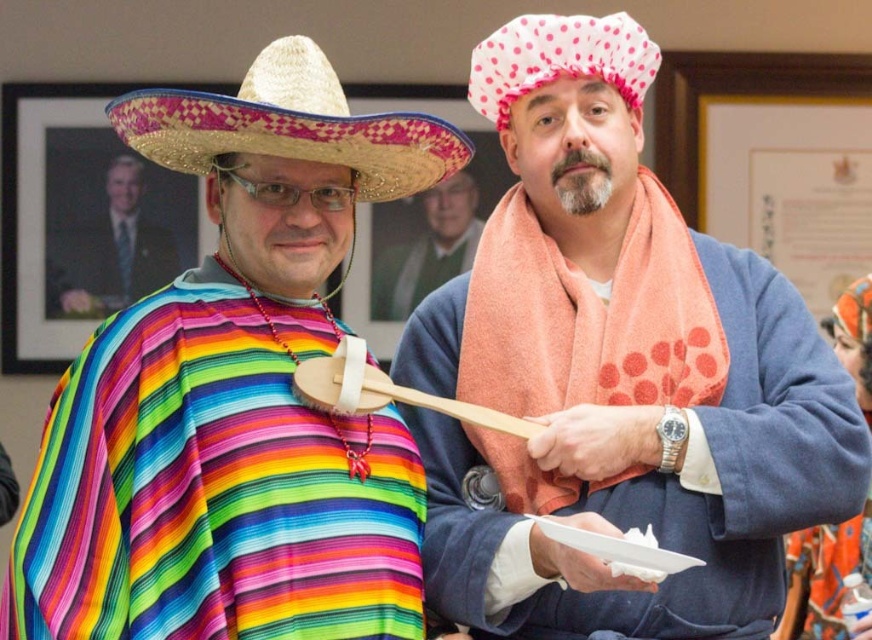
Question: Which of the following is the farthest from the observer?

Choices:
 (A) (584, 72)
 (B) (469, 568)
 (C) (402, 164)
 (D) (58, 259)

Answer: (D)

Question: Is pink polka dot fabric at upper center positioned at the back of wooden smooth spoon at center?

Choices:
 (A) yes
 (B) no

Answer: (A)

Question: Which point is farther from the camera taking this photo?

Choices:
 (A) (303, 397)
 (B) (146, 227)

Answer: (B)

Question: Which object is farther from the camera taking this photo?

Choices:
 (A) pink polka dot fabric at upper center
 (B) orange towel at right

Answer: (A)

Question: Does bright straw sombrero at left have a smaller size compared to wooden smooth spoon at center?

Choices:
 (A) no
 (B) yes

Answer: (A)

Question: Is rainbow fabric poncho at left to the right of bright straw sombrero at left from the viewer's perspective?

Choices:
 (A) no
 (B) yes

Answer: (A)